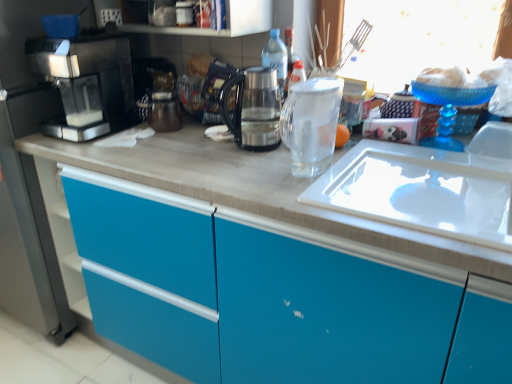
The image size is (512, 384). I want to click on vacant space positioned to the left of clear glass pitcher at center, the 2th kitchen appliance in the left-to-right sequence, so pos(248,173).